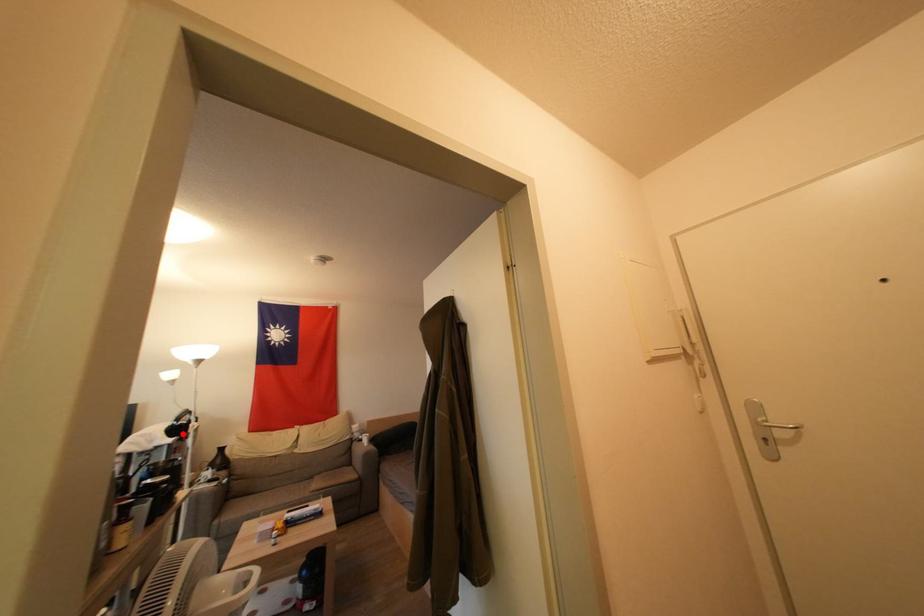
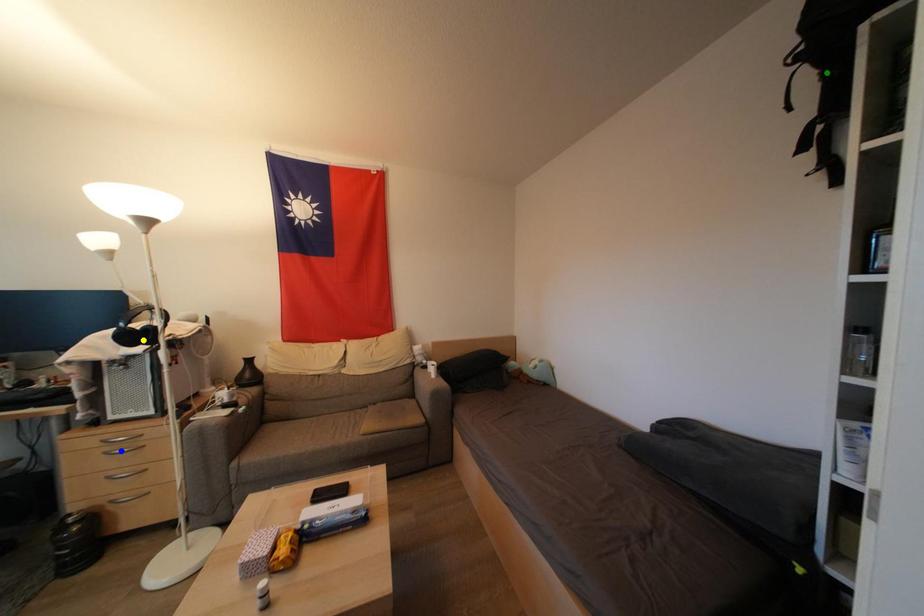
Question: I am providing you with two images of the same scene from different viewpoints. A red point is marked on the first image. You are given multiple points on the second image. Which point in image 2 represents the same 3d spot as the red point in image 1?

Choices:
 (A) green point
 (B) blue point
 (C) yellow point

Answer: (C)